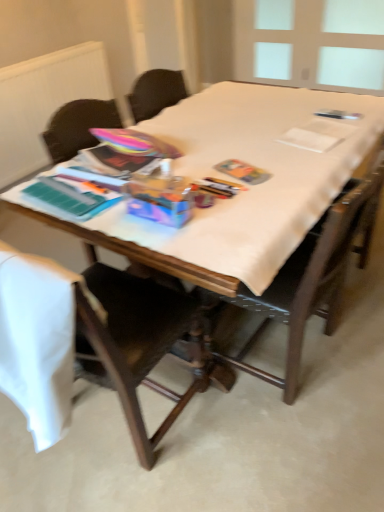
Question: Considering the relative sizes of wooden chair at left, which is the 2th chair in right-to-left order, and wooden chair at center, placed as the 1th chair when sorted from right to left, in the image provided, is wooden chair at left, which is the 2th chair in right-to-left order, taller than wooden chair at center, placed as the 1th chair when sorted from right to left,?

Choices:
 (A) no
 (B) yes

Answer: (B)

Question: From a real-world perspective, is wooden chair at left, which is the 2th chair in right-to-left order, below wooden chair at center, placed as the 2th chair when sorted from left to right?

Choices:
 (A) yes
 (B) no

Answer: (A)

Question: Can you confirm if wooden chair at left, which is the 2th chair in right-to-left order, is wider than wooden chair at center, placed as the 2th chair when sorted from left to right?

Choices:
 (A) yes
 (B) no

Answer: (A)

Question: Can you confirm if wooden chair at left, the first chair when ordered from left to right, is thinner than wooden chair at center, placed as the 2th chair when sorted from left to right?

Choices:
 (A) no
 (B) yes

Answer: (A)

Question: Considering the relative positions of wooden chair at left, the first chair when ordered from left to right, and wooden chair at center, placed as the 2th chair when sorted from left to right, in the image provided, is wooden chair at left, the first chair when ordered from left to right, in front of wooden chair at center, placed as the 2th chair when sorted from left to right,?

Choices:
 (A) yes
 (B) no

Answer: (A)

Question: In terms of height, does wooden table at center look taller or shorter compared to wooden chair at center, placed as the 1th chair when sorted from right to left?

Choices:
 (A) tall
 (B) short

Answer: (B)

Question: Does point (268, 89) appear closer or farther from the camera than point (362, 253)?

Choices:
 (A) closer
 (B) farther

Answer: (B)

Question: Is wooden table at center wider or thinner than wooden chair at center, placed as the 1th chair when sorted from right to left?

Choices:
 (A) thin
 (B) wide

Answer: (B)

Question: Is wooden table at center in front of or behind wooden chair at center, placed as the 1th chair when sorted from right to left, in the image?

Choices:
 (A) behind
 (B) front

Answer: (A)

Question: Considering the positions of wooden chair at center, placed as the 2th chair when sorted from left to right, and transparent plastic window screen at upper right in the image, is wooden chair at center, placed as the 2th chair when sorted from left to right, taller or shorter than transparent plastic window screen at upper right?

Choices:
 (A) short
 (B) tall

Answer: (B)

Question: In terms of size, does wooden chair at center, placed as the 1th chair when sorted from right to left, appear bigger or smaller than transparent plastic window screen at upper right?

Choices:
 (A) small
 (B) big

Answer: (B)

Question: Does point (288, 288) appear closer or farther from the camera than point (354, 81)?

Choices:
 (A) farther
 (B) closer

Answer: (B)

Question: From the image's perspective, is wooden chair at center, placed as the 2th chair when sorted from left to right, positioned above or below transparent plastic window screen at upper right?

Choices:
 (A) below
 (B) above

Answer: (A)

Question: From a real-world perspective, is white matte radiator at upper left positioned above or below transparent plastic window screen at upper right?

Choices:
 (A) above
 (B) below

Answer: (B)

Question: Considering their positions, is white matte radiator at upper left located in front of or behind transparent plastic window screen at upper right?

Choices:
 (A) behind
 (B) front

Answer: (B)